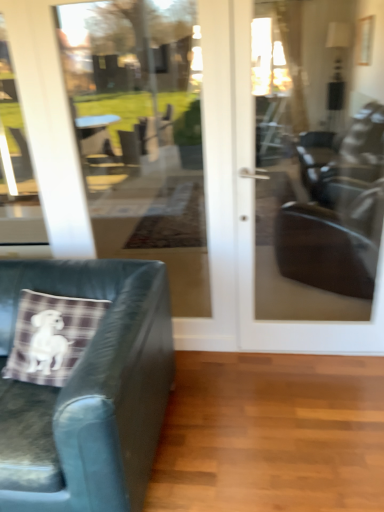
Question: In terms of width, does transparent glass door at center look wider or thinner when compared to plaid fabric pillow at lower left?

Choices:
 (A) wide
 (B) thin

Answer: (B)

Question: In terms of height, does transparent glass door at center look taller or shorter compared to plaid fabric pillow at lower left?

Choices:
 (A) tall
 (B) short

Answer: (A)

Question: Which of these objects is positioned closest to the transparent glass door at center?

Choices:
 (A) matte glass door at center
 (B) transparent glass door at upper left
 (C) plaid fabric pillow at lower left
 (D) leather cushion at left

Answer: (B)

Question: Estimate the real-world distances between objects in this image. Which object is closer to the matte glass door at center?

Choices:
 (A) plaid fabric pillow at lower left
 (B) leather cushion at left
 (C) transparent glass door at center
 (D) transparent glass door at upper left

Answer: (B)